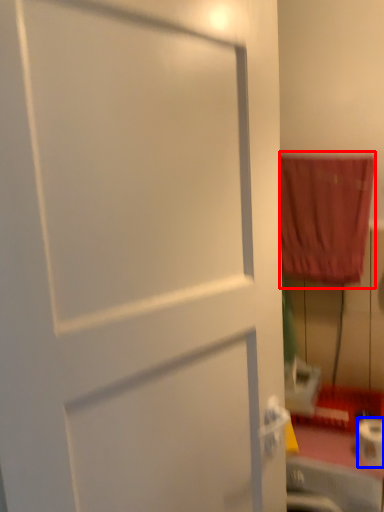
Question: Which object appears farthest to the camera in this image, curtain (highlighted by a red box) or toilet paper (highlighted by a blue box)?

Choices:
 (A) curtain
 (B) toilet paper

Answer: (A)